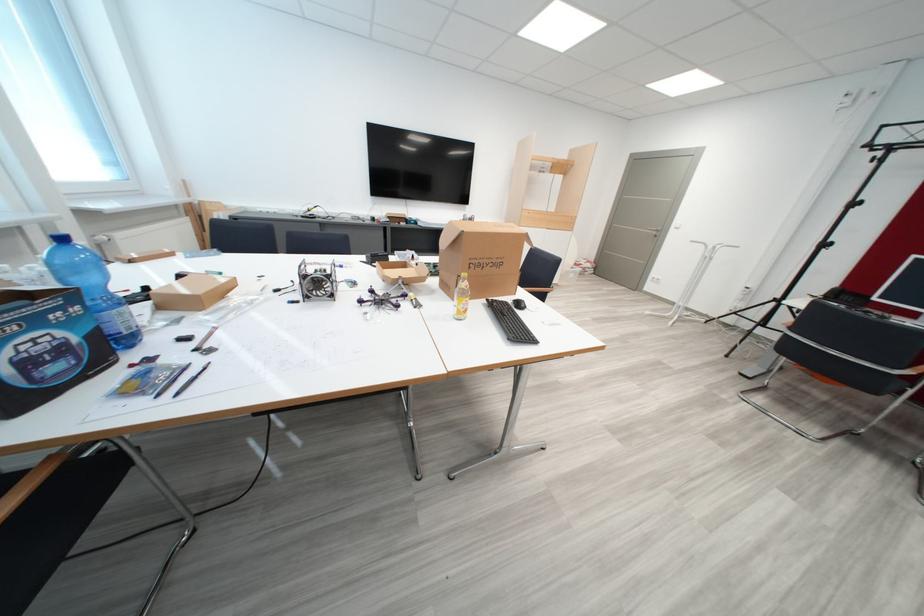
The width and height of the screenshot is (924, 616). What do you see at coordinates (540, 292) in the screenshot? I see `a dark chair sitting surface` at bounding box center [540, 292].